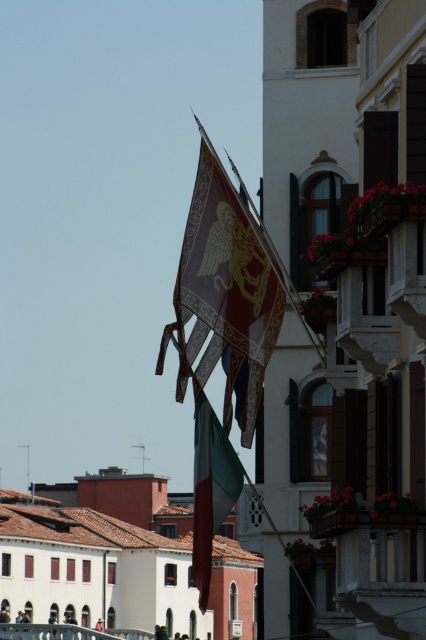
Question: Does metallic gold flag at center lie in front of green-white-red fabric flag at center?

Choices:
 (A) no
 (B) yes

Answer: (A)

Question: Does metallic gold flag at center appear under green-white-red fabric flag at center?

Choices:
 (A) no
 (B) yes

Answer: (A)

Question: Which point is closer to the camera?

Choices:
 (A) (221, 264)
 (B) (213, 417)

Answer: (A)

Question: Is metallic gold flag at center to the right of green-white-red fabric flag at center from the viewer's perspective?

Choices:
 (A) no
 (B) yes

Answer: (B)